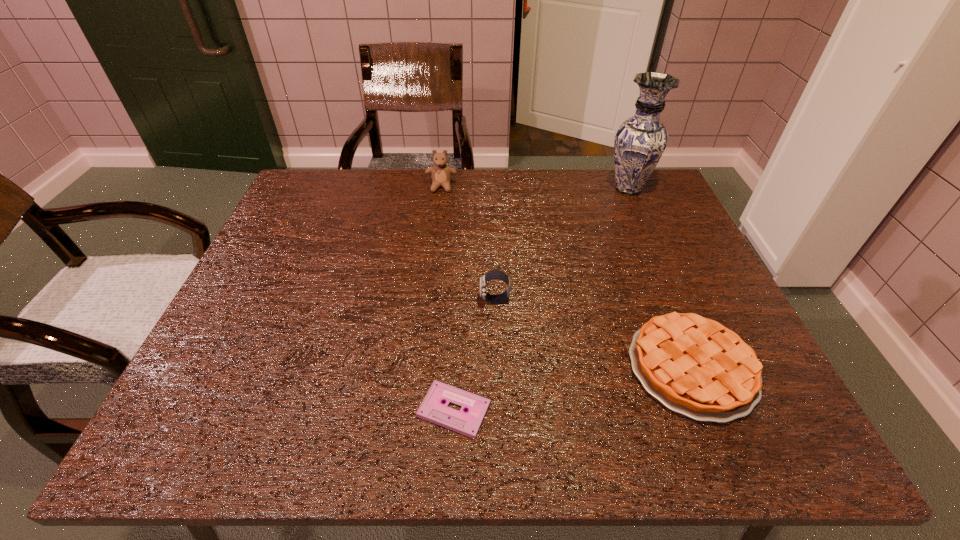
The image size is (960, 540). What are the coordinates of `object that is at the near right corner` in the screenshot? It's located at (695, 366).

The image size is (960, 540). I want to click on free space at the far edge, so click(x=420, y=207).

You are a GUI agent. You are given a task and a screenshot of the screen. Output one action in this format:
    pyautogui.click(x=<x>, y=<y>)
    Task: Click on the vacant space at the near edge
    
    Given the screenshot: What is the action you would take?
    pyautogui.click(x=399, y=444)

The image size is (960, 540). Identify the location of vacant space at the left edge of the desktop. (313, 244).

This screenshot has height=540, width=960. In order to click on vacant point at the right edge in this screenshot , I will do `click(657, 220)`.

The image size is (960, 540). I want to click on free region at the far left corner, so click(x=301, y=192).

Where is `free space at the far right corner`? The image size is (960, 540). free space at the far right corner is located at coordinates (641, 190).

The image size is (960, 540). I want to click on empty space between the third farthest object and the videotape, so click(474, 355).

The image size is (960, 540). In order to click on unoccupied position between the pie and the shortest object in this screenshot , I will do `click(573, 389)`.

This screenshot has width=960, height=540. In order to click on free spot between the tallest object and the third nearest object in this screenshot , I will do `click(562, 245)`.